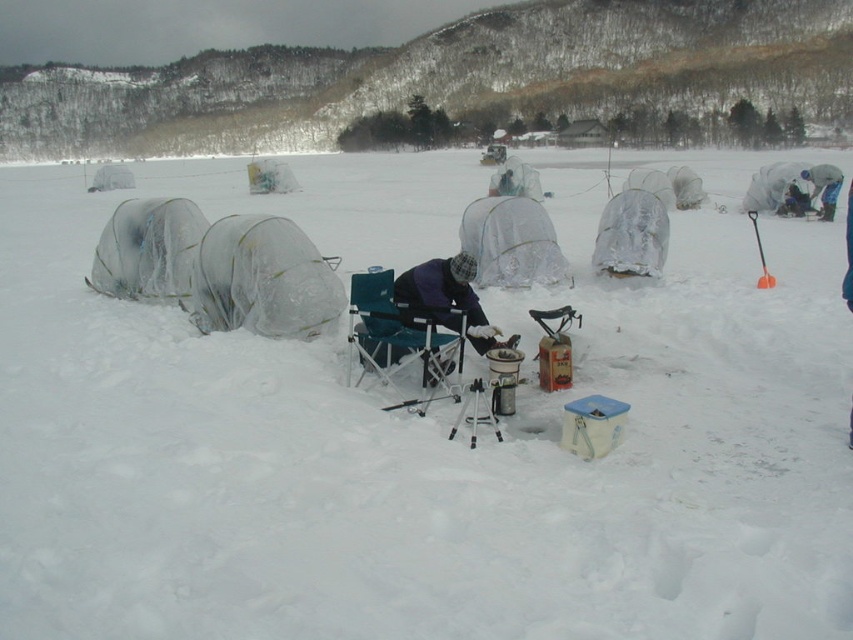
You are an observer looking at the winter scene. You notice the blue fabric jacket at upper right and the orange plastic shovel at right. Which object is narrower in width?

The blue fabric jacket at upper right is narrower in width compared to the orange plastic shovel at right.

You are standing at the edge of the frozen lake and see two points marked on the ice. The first point is at coordinate point (833, 177) and the second point is at coordinate point (764, 266). Which point is closer to you?

Point (833, 177) is further to the viewer than point (764, 266), so the second point is closer to you.

You are an ice fisherman who just arrived at the site. You need to place your equipment. The blue fabric jacket at upper right is where you will keep your warm clothing. The orange plastic shovel at right is where you will store your tools. How far apart are these two storage locations?

The blue fabric jacket at upper right and orange plastic shovel at right are 8.46 feet apart from each other.